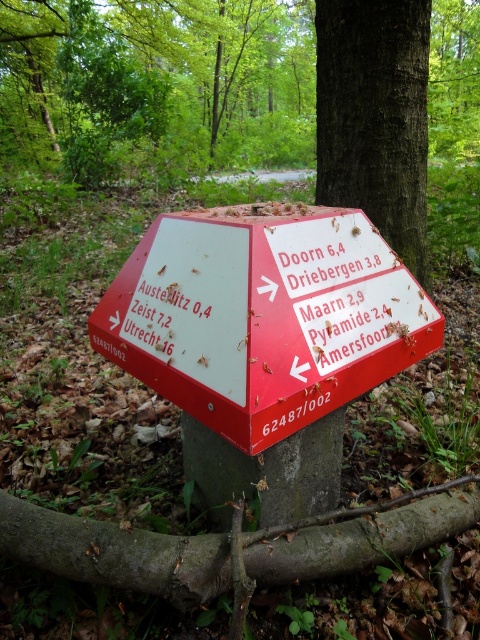
The height and width of the screenshot is (640, 480). Describe the element at coordinates (264, 316) in the screenshot. I see `red plastic sign at center` at that location.

The height and width of the screenshot is (640, 480). I want to click on red plastic sign at center, so click(264, 316).